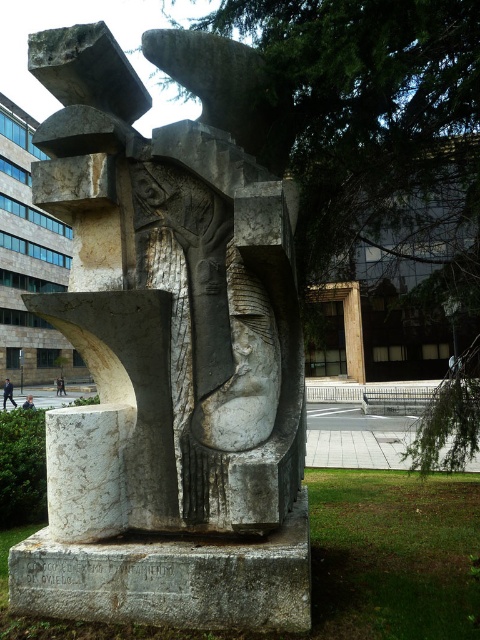
Question: Observing the image, what is the correct spatial positioning of white marble sculpture at center in reference to dark suit at lower left?

Choices:
 (A) above
 (B) below

Answer: (A)

Question: Is white marble sculpture at center behind dark blue jeans at lower left?

Choices:
 (A) yes
 (B) no

Answer: (B)

Question: Based on their relative distances, which object is nearer to the white marble sculpture at center?

Choices:
 (A) dark suit at lower left
 (B) dark blue jeans at lower left

Answer: (B)

Question: Among these points, which one is nearest to the camera?

Choices:
 (A) (207, 252)
 (B) (3, 388)
 (C) (34, 406)

Answer: (A)

Question: Which point is farther to the camera?

Choices:
 (A) (9, 380)
 (B) (87, 285)

Answer: (A)

Question: Is the position of dark suit at lower left more distant than that of dark blue jeans at lower left?

Choices:
 (A) yes
 (B) no

Answer: (A)